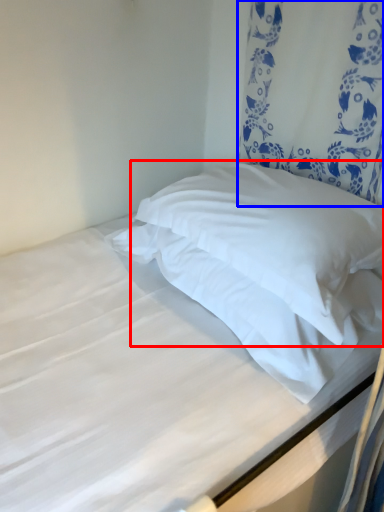
Question: Which point is closer to the camera, pillow (highlighted by a red box) or curtain (highlighted by a blue box)?

Choices:
 (A) pillow
 (B) curtain

Answer: (A)